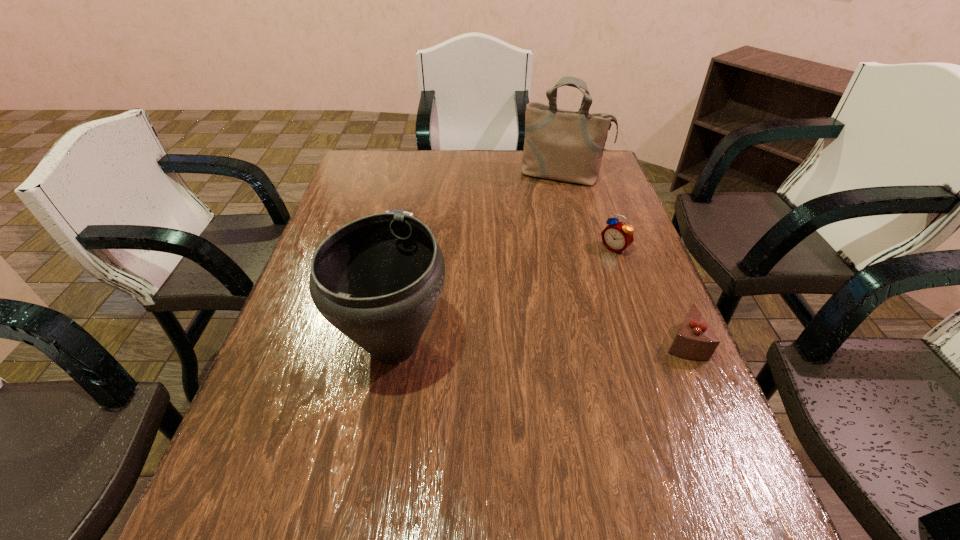
In order to click on the second tallest object in this screenshot , I will do `click(377, 279)`.

Locate an element on the screen. Image resolution: width=960 pixels, height=540 pixels. chocolate cake is located at coordinates (695, 340).

Find the location of a particular element. The height and width of the screenshot is (540, 960). goggles is located at coordinates (397, 211).

You are a GUI agent. You are given a task and a screenshot of the screen. Output one action in this format:
    pyautogui.click(x=<x>, y=<y>)
    Task: Click on the third shortest object
    
    Given the screenshot: What is the action you would take?
    pyautogui.click(x=617, y=236)

Identify the location of the tallest object. (562, 145).

Where is `shoulder bag`? shoulder bag is located at coordinates (562, 145).

At what (x,y) coordinates should I click in order to perform the action: click on blank area located 0.290m on the right of the second tallest object. Please return your answer as a coordinate pair (x, y). Image resolution: width=960 pixels, height=540 pixels. Looking at the image, I should click on (581, 346).

Identify the location of vacant region located on the front of the chocolate cake. (727, 447).

The image size is (960, 540). Identify the location of vacant position located on the front-facing side of the goggles. (479, 296).

Locate an element on the screen. free spot located 0.090m on the front-facing side of the goggles is located at coordinates (424, 258).